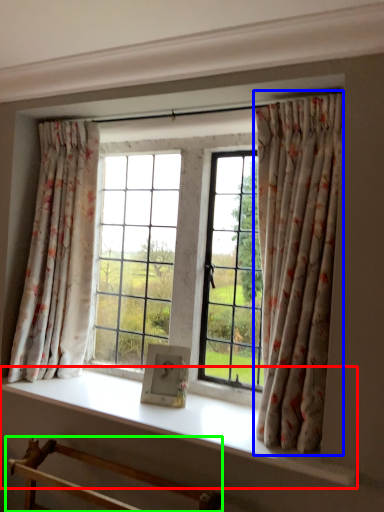
Question: Estimate the real-world distances between objects in this image. Which object is closer to window sill (highlighted by a red box), curtain (highlighted by a blue box) or furniture (highlighted by a green box)?

Choices:
 (A) curtain
 (B) furniture

Answer: (B)